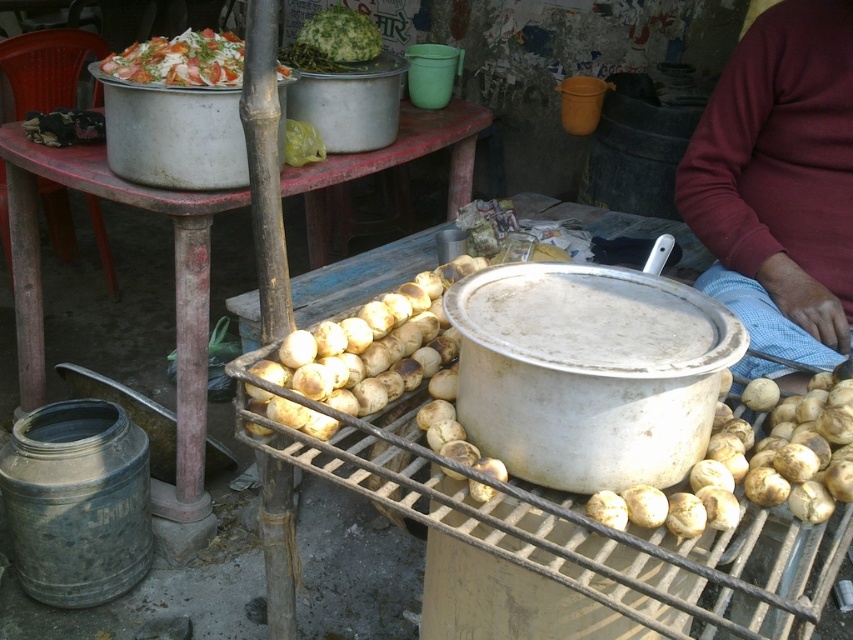
You are a customer at the food stall and want to place your order. You see the wooden table at center and the white creamy salad at upper left. Which object is higher in elevation?

The wooden table at center is taller than the white creamy salad at upper left, so the wooden table at center is higher in elevation.

You are a food vendor who wants to move the wooden table at center closer to the grill. The vendor has a cart that can carry items up to 1.5 meters. Can the vendor move the table without needing to move any items from the table?

The distance between the wooden table at center and the grill is 1.64 meters. Since the vendor can only carry items up to 1.5 meters, they cannot move the table without needing to move some items from the table.

You are standing at the entrance of the street food stall. Where is the wooden table at center located in terms of coordinates?

The wooden table at center is located at point (173, 291).